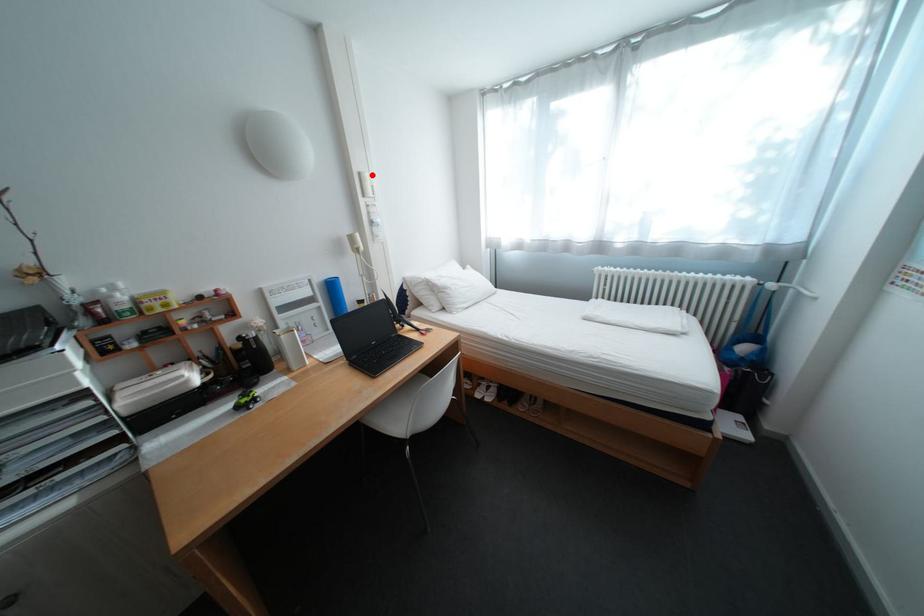
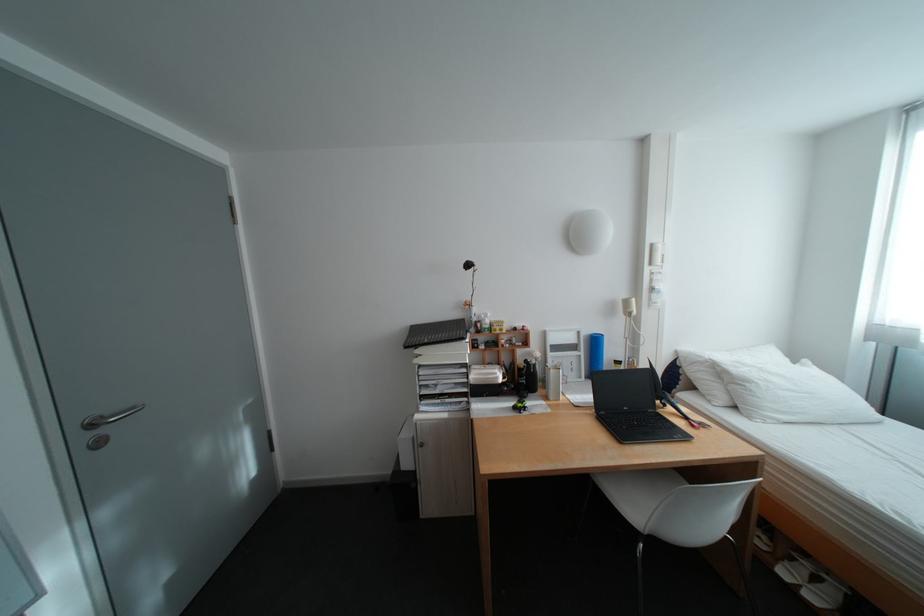
In the second image, find the point that corresponds to the highlighted location in the first image.

(664, 246)